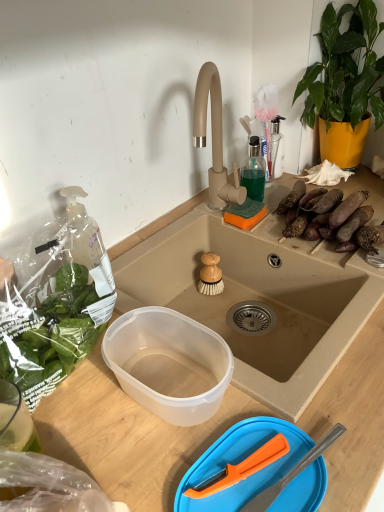
Question: Can you confirm if transparent plastic bowl at lower center is shorter than wooden-bristled brush at sink center?

Choices:
 (A) no
 (B) yes

Answer: (B)

Question: Is wooden-bristled brush at sink center at the back of transparent plastic bowl at lower center?

Choices:
 (A) yes
 (B) no

Answer: (B)

Question: Considering the relative positions of transparent plastic bowl at lower center and wooden-bristled brush at sink center in the image provided, is transparent plastic bowl at lower center to the right of wooden-bristled brush at sink center from the viewer's perspective?

Choices:
 (A) yes
 (B) no

Answer: (B)

Question: Is transparent plastic bowl at lower center directly adjacent to wooden-bristled brush at sink center?

Choices:
 (A) yes
 (B) no

Answer: (B)

Question: Is transparent plastic bowl at lower center oriented towards wooden-bristled brush at sink center?

Choices:
 (A) yes
 (B) no

Answer: (B)

Question: In terms of height, does wooden-bristled brush at sink center look taller or shorter compared to transparent plastic bowl at lower center?

Choices:
 (A) short
 (B) tall

Answer: (B)

Question: From the image's perspective, is wooden-bristled brush at sink center above or below transparent plastic bowl at lower center?

Choices:
 (A) below
 (B) above

Answer: (B)

Question: From a real-world perspective, relative to transparent plastic bowl at lower center, is wooden-bristled brush at sink center vertically above or below?

Choices:
 (A) below
 (B) above

Answer: (A)

Question: Considering the relative positions of wooden-bristled brush at sink center and transparent plastic bowl at lower center in the image provided, is wooden-bristled brush at sink center to the left or to the right of transparent plastic bowl at lower center?

Choices:
 (A) left
 (B) right

Answer: (B)

Question: From the image's perspective, is brown rough sweet potatoes at right positioned above or below transparent plastic container at center?

Choices:
 (A) below
 (B) above

Answer: (B)

Question: Looking at the image, does brown rough sweet potatoes at right seem bigger or smaller compared to transparent plastic container at center?

Choices:
 (A) big
 (B) small

Answer: (B)

Question: From a real-world perspective, is brown rough sweet potatoes at right above or below transparent plastic container at center?

Choices:
 (A) above
 (B) below

Answer: (A)

Question: Is brown rough sweet potatoes at right situated inside transparent plastic container at center or outside?

Choices:
 (A) outside
 (B) inside

Answer: (A)

Question: Is transparent plastic bowl at lower center taller or shorter than brown rough sweet potatoes at right?

Choices:
 (A) tall
 (B) short

Answer: (B)

Question: Is transparent plastic bowl at lower center spatially inside brown rough sweet potatoes at right, or outside of it?

Choices:
 (A) inside
 (B) outside

Answer: (B)